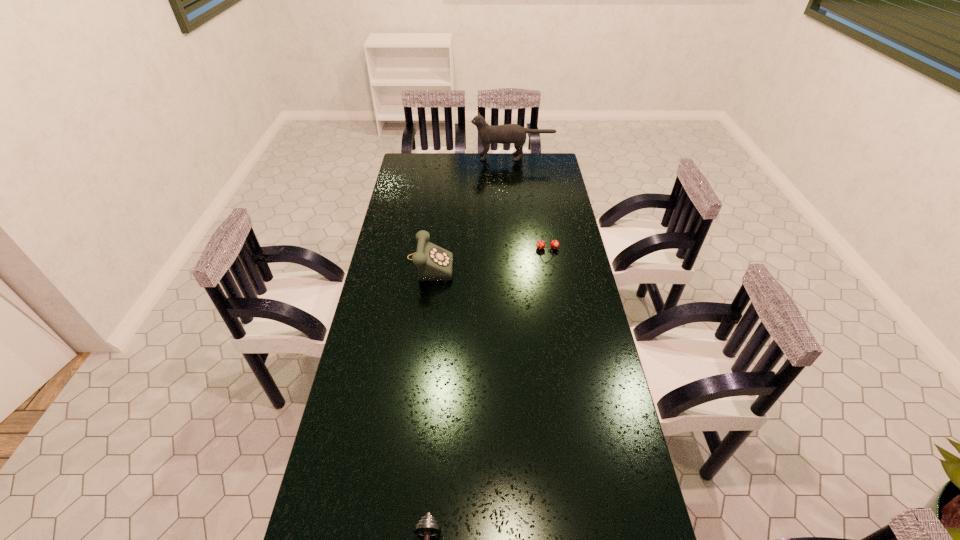
Where is `the farthest object`? This screenshot has height=540, width=960. the farthest object is located at coordinates (510, 133).

This screenshot has height=540, width=960. Identify the location of the tallest object. (510, 133).

This screenshot has width=960, height=540. In order to click on the second tallest object in this screenshot , I will do `click(434, 263)`.

Find the location of a particular element. The width and height of the screenshot is (960, 540). the second shortest object is located at coordinates (554, 244).

In order to click on free spot located 0.300m on the front-facing side of the farthest object in this screenshot , I will do `click(415, 157)`.

Locate an element on the screen. vacant area located 0.080m on the front-facing side of the farthest object is located at coordinates (456, 157).

Locate an element on the screen. This screenshot has height=540, width=960. free space located 0.190m on the front-facing side of the farthest object is located at coordinates (436, 157).

Image resolution: width=960 pixels, height=540 pixels. I want to click on free spot located 0.120m on the dial of the third shortest object, so click(x=484, y=262).

In order to click on free point located 0.270m with stems pointing upwards on the third tallest object in this screenshot , I will do `click(556, 300)`.

Locate an element on the screen. Image resolution: width=960 pixels, height=540 pixels. object that is at the far edge is located at coordinates (510, 133).